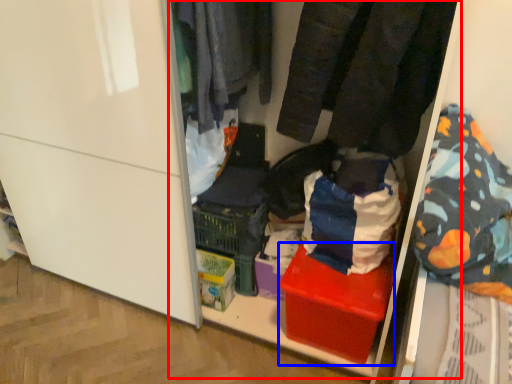
Question: Which point is closer to the camera, shelf (highlighted by a red box) or box (highlighted by a blue box)?

Choices:
 (A) shelf
 (B) box

Answer: (A)